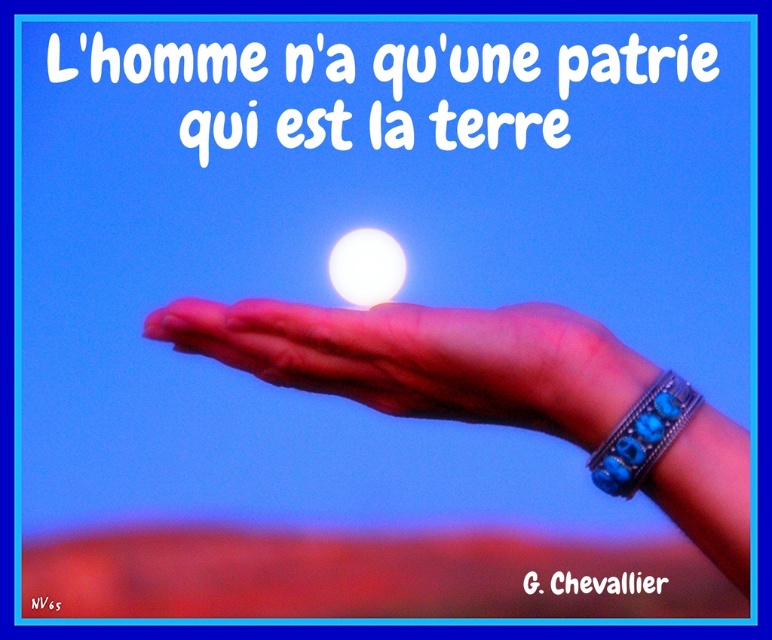
Question: Does blue stone bracelet at lower right come behind white glossy sphere at center?

Choices:
 (A) no
 (B) yes

Answer: (A)

Question: Which point is farther to the camera?

Choices:
 (A) pink leather bracelet at center
 (B) pink leather hand at center
 (C) white glossy sphere at center
 (D) blue stone bracelet at lower right

Answer: (C)

Question: Among these objects, which one is nearest to the camera?

Choices:
 (A) pink leather hand at center
 (B) blue stone bracelet at lower right
 (C) pink leather bracelet at center

Answer: (C)

Question: Considering the relative positions of blue stone bracelet at lower right and white glossy sphere at center in the image provided, where is blue stone bracelet at lower right located with respect to white glossy sphere at center?

Choices:
 (A) below
 (B) above

Answer: (A)

Question: Which point is farther to the camera?

Choices:
 (A) (627, 454)
 (B) (539, 419)
 (C) (322, 308)
 (D) (366, 269)

Answer: (D)

Question: Can you confirm if pink leather bracelet at center is thinner than blue stone bracelet at lower right?

Choices:
 (A) yes
 (B) no

Answer: (B)